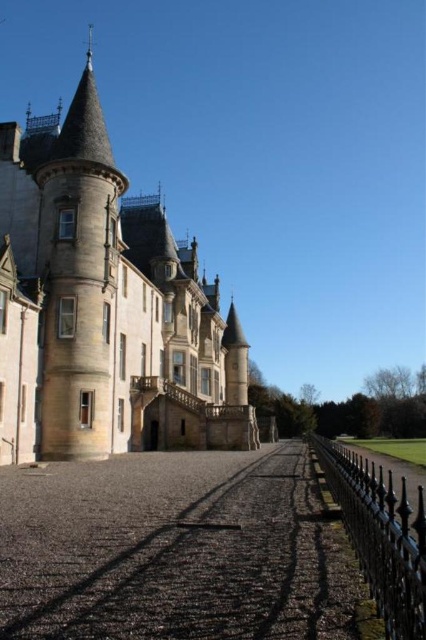
Is brown stone castle at center below black wrought iron fence at lower right?

Actually, brown stone castle at center is above black wrought iron fence at lower right.

Who is more forward, (3, 140) or (385, 624)?

Point (385, 624) is more forward.

Does point (143, 260) lie in front of point (345, 497)?

No, it is not.

Locate an element on the screen. Image resolution: width=426 pixels, height=640 pixels. brown stone castle at center is located at coordinates (114, 300).

Based on the photo, is dark asphalt driveway at center to the right of black wrought iron fence at lower right from the viewer's perspective?

Incorrect, dark asphalt driveway at center is not on the right side of black wrought iron fence at lower right.

Which is more to the right, dark asphalt driveway at center or black wrought iron fence at lower right?

Positioned to the right is black wrought iron fence at lower right.

Locate an element on the screen. The image size is (426, 640). dark asphalt driveway at center is located at coordinates click(x=175, y=548).

This screenshot has width=426, height=640. What are the coordinates of `dark asphalt driveway at center` in the screenshot? It's located at (175, 548).

Does point (183, 509) come in front of point (178, 420)?

Yes.

Can you confirm if dark asphalt driveway at center is bigger than brown stone castle at center?

No, dark asphalt driveway at center is not bigger than brown stone castle at center.

Is point (94, 531) closer to viewer compared to point (40, 406)?

Yes, it is in front of point (40, 406).

Where is `dark asphalt driveway at center`? dark asphalt driveway at center is located at coordinates (175, 548).